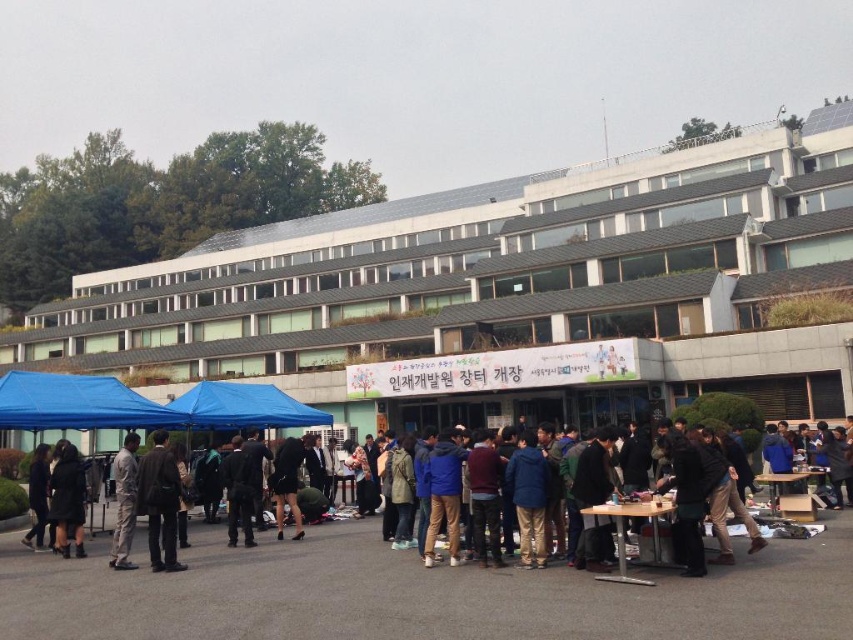
Question: Where is dark brown leather jacket at center located in relation to dark blue jacket at center in the image?

Choices:
 (A) right
 (B) left

Answer: (B)

Question: Can you confirm if black fabric jacket at center is bigger than dark blue jacket at center?

Choices:
 (A) no
 (B) yes

Answer: (A)

Question: Which point is farther from the camera taking this photo?

Choices:
 (A) (119, 500)
 (B) (68, 460)

Answer: (B)

Question: Which of the following is the closest to the observer?

Choices:
 (A) blue fabric canopy at center
 (B) light gray fabric pants at lower left
 (C) blue fabric canopy at lower left

Answer: (B)

Question: Does black matte coat at lower left come in front of light gray fabric pants at lower left?

Choices:
 (A) yes
 (B) no

Answer: (B)

Question: Among these points, which one is farthest from the camera?

Choices:
 (A) (244, 468)
 (B) (192, 387)

Answer: (B)